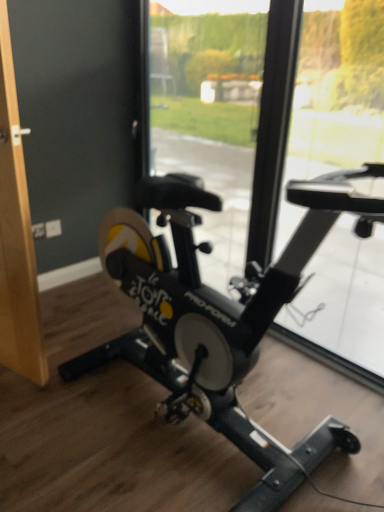
At what (x,y) coordinates should I click in order to perform the action: click on blank area beneath black matte stationary bicycle at center (from a real-world perspective). Please return your answer as a coordinate pair (x, y). The width and height of the screenshot is (384, 512). Looking at the image, I should click on (x=199, y=431).